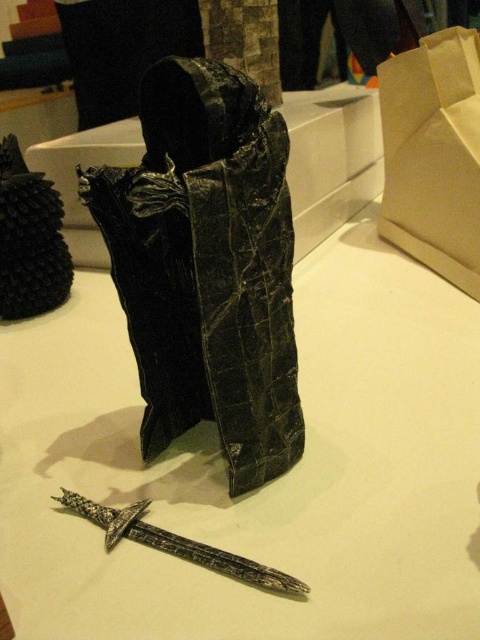
Does point (463, 90) lie behind point (105, 512)?

Yes, point (463, 90) is behind point (105, 512).

Is the position of brown/kraft paper bag at upper right more distant than that of silver metallic sword at center?

Yes, it is behind silver metallic sword at center.

Describe the element at coordinates (433, 154) in the screenshot. I see `brown/kraft paper bag at upper right` at that location.

Find the location of a particular element. brown/kraft paper bag at upper right is located at coordinates (433, 154).

Is white matte table at center positioned behind silver metallic sword at center?

No, it is in front of silver metallic sword at center.

What do you see at coordinates (265, 484) in the screenshot? The image size is (480, 640). I see `white matte table at center` at bounding box center [265, 484].

In order to click on white matte table at center in this screenshot , I will do `click(265, 484)`.

Is leather-like black armor at center taller than silver metallic sword at center?

Yes, leather-like black armor at center is taller than silver metallic sword at center.

Does leather-like black armor at center have a smaller size compared to silver metallic sword at center?

Actually, leather-like black armor at center might be larger than silver metallic sword at center.

Locate an element on the screen. Image resolution: width=480 pixels, height=640 pixels. leather-like black armor at center is located at coordinates (206, 266).